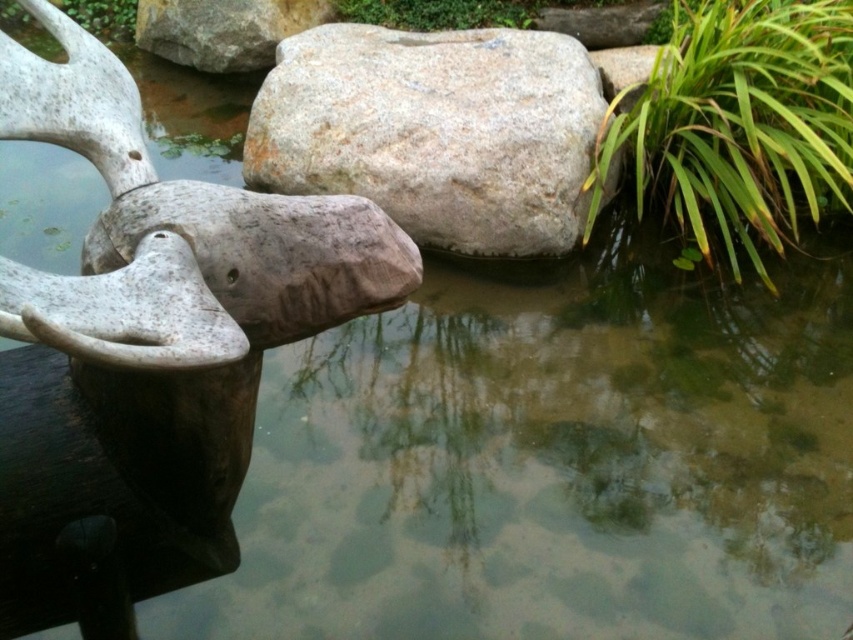
Question: Which object is farther from the camera taking this photo?

Choices:
 (A) gray/rough stone at center
 (B) gray granite rock at upper center

Answer: (B)

Question: Does green leafy plant at right have a lesser width compared to gray granite rock at upper center?

Choices:
 (A) yes
 (B) no

Answer: (A)

Question: In this image, where is gray granite rock at upper center located relative to green leafy plant at upper center?

Choices:
 (A) below
 (B) above

Answer: (A)

Question: Is white stone sculpture at upper left above gray granite rock at upper center?

Choices:
 (A) no
 (B) yes

Answer: (A)

Question: Which is nearer to the gray granite rock at upper center?

Choices:
 (A) green leafy plant at upper left
 (B) gray/rough stone at center
 (C) green leafy plant at upper center

Answer: (A)

Question: Which point is farther to the camera?

Choices:
 (A) (439, 188)
 (B) (679, 193)
 (C) (239, 44)
 (D) (120, 33)

Answer: (D)